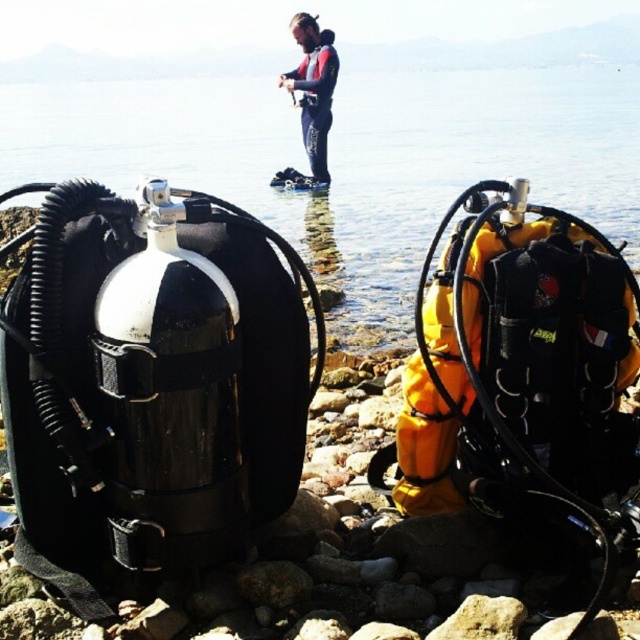
Question: Among these objects, which one is farthest from the camera?

Choices:
 (A) red wetsuit at center
 (B) transparent water at center

Answer: (A)

Question: Does transparent water at center come in front of red wetsuit at center?

Choices:
 (A) no
 (B) yes

Answer: (B)

Question: Which point is closer to the camera?

Choices:
 (A) red wetsuit at center
 (B) transparent water at center

Answer: (B)

Question: Does transparent water at center appear under red wetsuit at center?

Choices:
 (A) no
 (B) yes

Answer: (A)

Question: Does transparent water at center lie in front of red wetsuit at center?

Choices:
 (A) no
 (B) yes

Answer: (B)